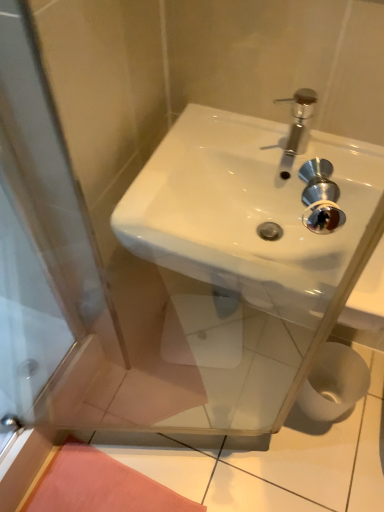
Question: Is white glossy sink at center far from white matte toilet paper at lower right?

Choices:
 (A) no
 (B) yes

Answer: (A)

Question: Does white glossy sink at center have a greater width compared to white matte toilet paper at lower right?

Choices:
 (A) no
 (B) yes

Answer: (B)

Question: Is white glossy sink at center beside white matte toilet paper at lower right?

Choices:
 (A) yes
 (B) no

Answer: (B)

Question: From a real-world perspective, does white glossy sink at center sit lower than white matte toilet paper at lower right?

Choices:
 (A) yes
 (B) no

Answer: (B)

Question: Is white glossy sink at center positioned beyond the bounds of white matte toilet paper at lower right?

Choices:
 (A) no
 (B) yes

Answer: (B)

Question: Is white glossy sink at center facing away from white matte toilet paper at lower right?

Choices:
 (A) no
 (B) yes

Answer: (A)

Question: Considering the relative sizes of white matte toilet paper at lower right and white glossy sink at center in the image provided, is white matte toilet paper at lower right bigger than white glossy sink at center?

Choices:
 (A) no
 (B) yes

Answer: (A)

Question: Is white glossy sink at center inside white matte toilet paper at lower right?

Choices:
 (A) yes
 (B) no

Answer: (B)

Question: From the image's perspective, is white matte toilet paper at lower right under white glossy sink at center?

Choices:
 (A) yes
 (B) no

Answer: (A)

Question: From a real-world perspective, is white matte toilet paper at lower right on white glossy sink at center?

Choices:
 (A) yes
 (B) no

Answer: (B)

Question: Does white matte toilet paper at lower right have a lesser height compared to white glossy sink at center?

Choices:
 (A) no
 (B) yes

Answer: (A)

Question: Is white matte toilet paper at lower right aimed at white glossy sink at center?

Choices:
 (A) yes
 (B) no

Answer: (B)

Question: Considering the positions of point (360, 188) and point (322, 387), is point (360, 188) closer or farther from the camera than point (322, 387)?

Choices:
 (A) farther
 (B) closer

Answer: (B)